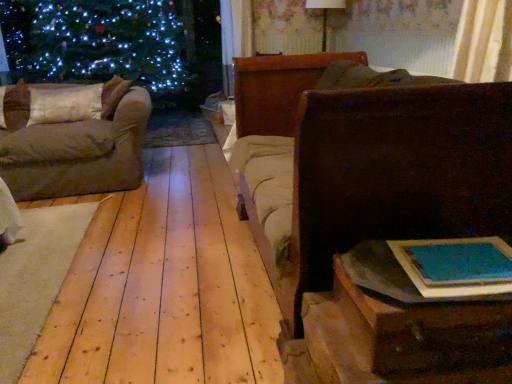
Question: Does blue paper book at lower right appear on the right side of white fabric pillow at left?

Choices:
 (A) yes
 (B) no

Answer: (A)

Question: From a real-world perspective, is blue paper book at lower right on white fabric pillow at left?

Choices:
 (A) yes
 (B) no

Answer: (B)

Question: Considering the relative sizes of blue paper book at lower right and white fabric pillow at left in the image provided, is blue paper book at lower right smaller than white fabric pillow at left?

Choices:
 (A) yes
 (B) no

Answer: (A)

Question: Does blue paper book at lower right turn towards white fabric pillow at left?

Choices:
 (A) no
 (B) yes

Answer: (A)

Question: From a real-world perspective, does blue paper book at lower right sit lower than white fabric pillow at left?

Choices:
 (A) yes
 (B) no

Answer: (A)

Question: Is point (403, 89) closer or farther from the camera than point (423, 311)?

Choices:
 (A) farther
 (B) closer

Answer: (A)

Question: Relative to wooden table at lower right, is dark brown wood chest at right in front or behind?

Choices:
 (A) behind
 (B) front

Answer: (A)

Question: Is dark brown wood chest at right inside or outside of wooden table at lower right?

Choices:
 (A) outside
 (B) inside

Answer: (A)

Question: From the image's perspective, is dark brown wood chest at right above or below wooden table at lower right?

Choices:
 (A) above
 (B) below

Answer: (A)

Question: From the image's perspective, is blue paper book at lower right located above or below dark brown wood chest at right?

Choices:
 (A) below
 (B) above

Answer: (A)

Question: Considering the positions of blue paper book at lower right and dark brown wood chest at right in the image, is blue paper book at lower right wider or thinner than dark brown wood chest at right?

Choices:
 (A) wide
 (B) thin

Answer: (B)

Question: Considering the positions of blue paper book at lower right and dark brown wood chest at right in the image, is blue paper book at lower right taller or shorter than dark brown wood chest at right?

Choices:
 (A) tall
 (B) short

Answer: (B)

Question: From a real-world perspective, is blue paper book at lower right above or below dark brown wood chest at right?

Choices:
 (A) below
 (B) above

Answer: (B)

Question: Is dark brown wood chest at right spatially inside white fabric pillow at left, or outside of it?

Choices:
 (A) outside
 (B) inside

Answer: (A)

Question: Is dark brown wood chest at right bigger or smaller than white fabric pillow at left?

Choices:
 (A) small
 (B) big

Answer: (B)